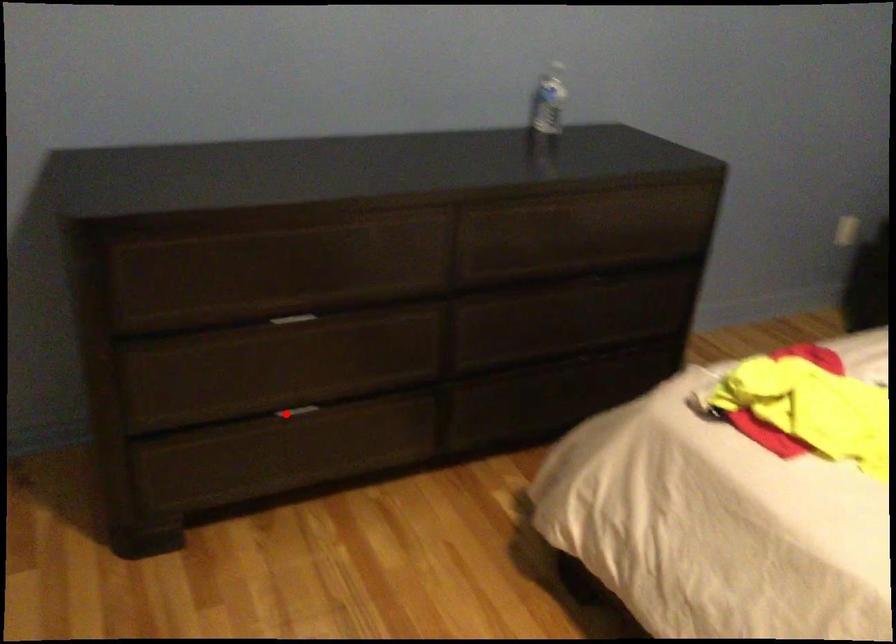
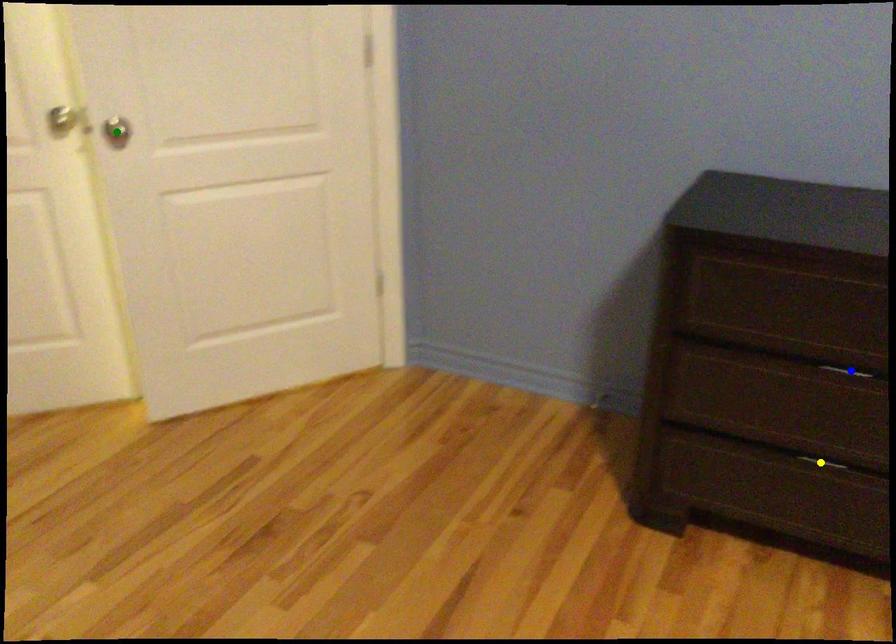
Question: I am providing you with two images of the same scene from different viewpoints. A red point is marked on the first image. You are given multiple points on the second image. Can you choose the point in image 2 that corresponds to the point in image 1?

Choices:
 (A) green point
 (B) yellow point
 (C) blue point

Answer: (B)